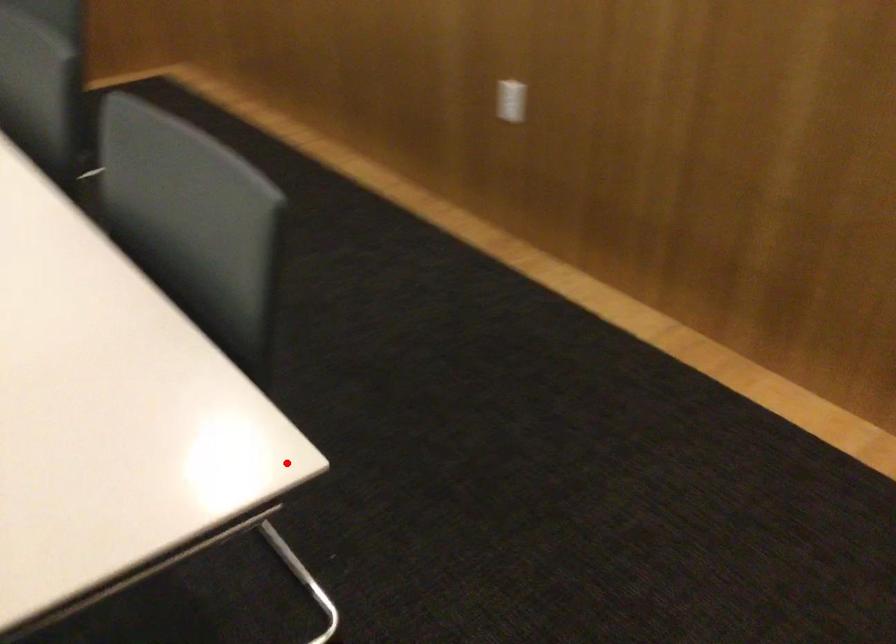
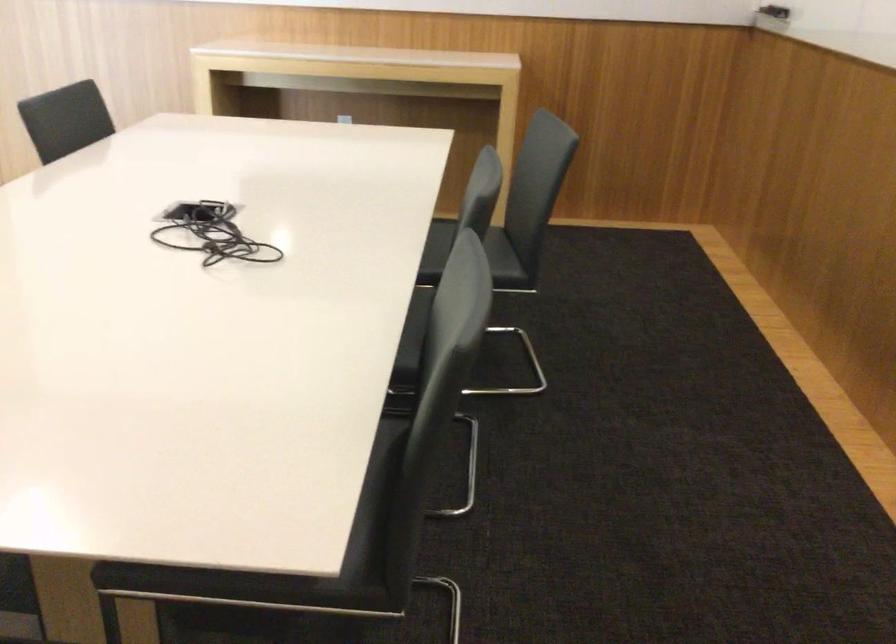
The point at the highlighted location is marked in the first image. Where is the corresponding point in the second image?

(311, 558)